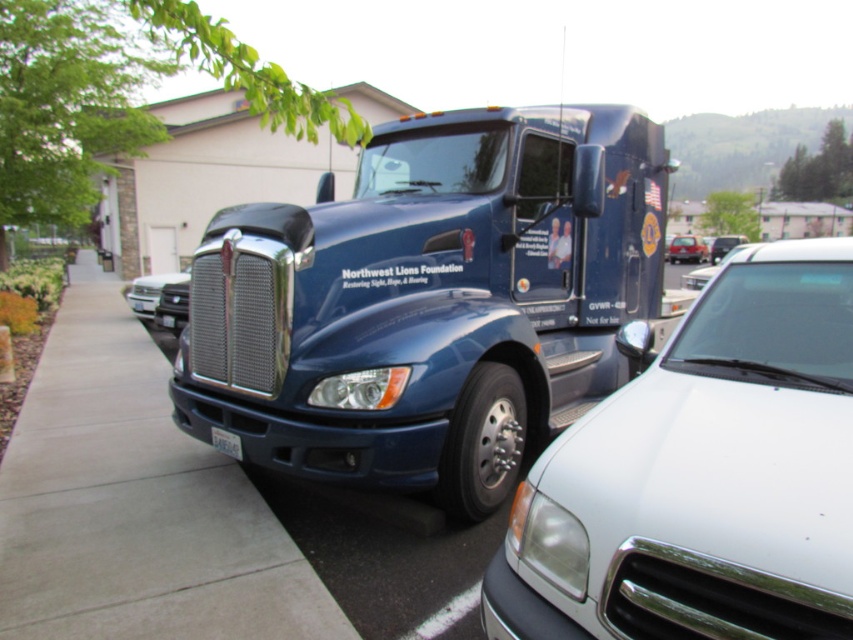
You are a delivery driver who needs to park your truck in a tight space. You see the glossy blue trailer truck at center and the white glossy car at center. Is there enough space between them to safely maneuver your truck, which is 2.5 meters wide?

The distance between the glossy blue trailer truck at center and the white glossy car at center is 2.46 meters. Since your truck is 2.5 meters wide, there is not enough space to safely maneuver between them.

You are a pedestrian standing on the sidewalk looking at the matte black truck at center and the white plastic license plate at lower center. Which object is closer to you?

The white plastic license plate at lower center is closer to you because it is positioned behind the matte black truck at center, meaning it is nearer to your viewpoint on the sidewalk.

You are standing at the point marked by the coordinate point (135, 502) on the image. What material are you standing on?

You are standing on concrete at center, as the point (135, 502) represents the concrete at center.